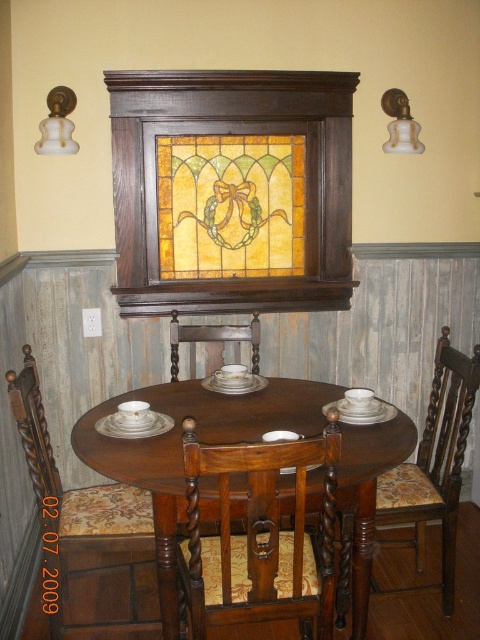
Is stained glass at center below brown wood chair at center?

Actually, stained glass at center is above brown wood chair at center.

The height and width of the screenshot is (640, 480). Identify the location of stained glass at center. (229, 205).

Describe the element at coordinates (229, 205) in the screenshot. I see `stained glass at center` at that location.

You are a GUI agent. You are given a task and a screenshot of the screen. Output one action in this format:
    pyautogui.click(x=<x>, y=<y>)
    Task: Click on the stained glass at center
    
    Given the screenshot: What is the action you would take?
    pyautogui.click(x=229, y=205)

Does point (177, 472) come in front of point (452, 540)?

Yes, it is.

Is mahogany wood table at center taller than wooden chair with floral upholstery at lower right?

No.

Does point (368, 557) lie behind point (418, 564)?

No, (368, 557) is in front of (418, 564).

I want to click on mahogany wood table at center, so click(x=181, y=451).

Could you measure the distance between wooden chair with floral upholstery at lower right and brown wood chair at center?

wooden chair with floral upholstery at lower right is 86.41 centimeters from brown wood chair at center.

Between point (455, 508) and point (212, 348), which one is positioned in front?

Point (455, 508)

You are a GUI agent. You are given a task and a screenshot of the screen. Output one action in this format:
    pyautogui.click(x=<x>, y=<y>)
    Task: Click on the wooden chair with floral upholstery at lower right
    
    Given the screenshot: What is the action you would take?
    pyautogui.click(x=433, y=467)